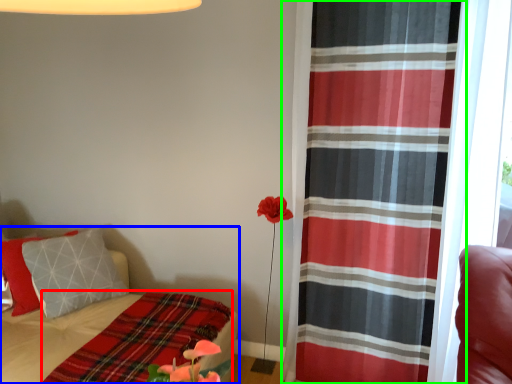
Question: Which is farther away from blanket (highlighted by a red box)? bed (highlighted by a blue box) or curtain (highlighted by a green box)?

Choices:
 (A) bed
 (B) curtain

Answer: (B)